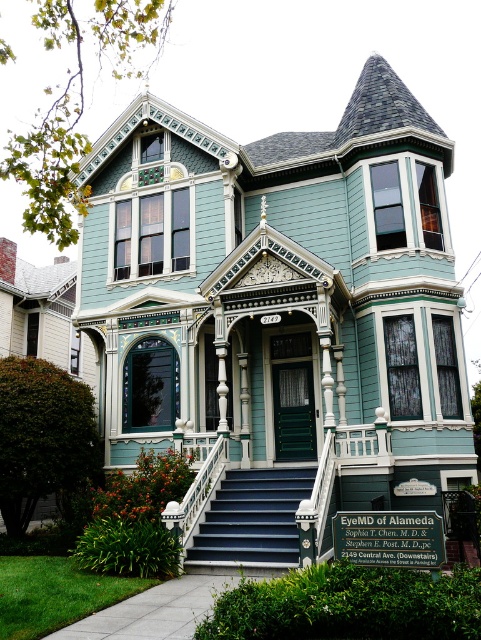
Question: Is blue painted wood stairs at center to the left of white glossy balustrade at center from the viewer's perspective?

Choices:
 (A) no
 (B) yes

Answer: (A)

Question: Can you confirm if blue painted wood stairs at center is positioned above white glossy balustrade at center?

Choices:
 (A) yes
 (B) no

Answer: (B)

Question: In this image, where is blue painted wood stairs at center located relative to white glossy balustrade at center?

Choices:
 (A) left
 (B) right

Answer: (B)

Question: Which point is closer to the camera?

Choices:
 (A) (254, 534)
 (B) (205, 481)

Answer: (A)